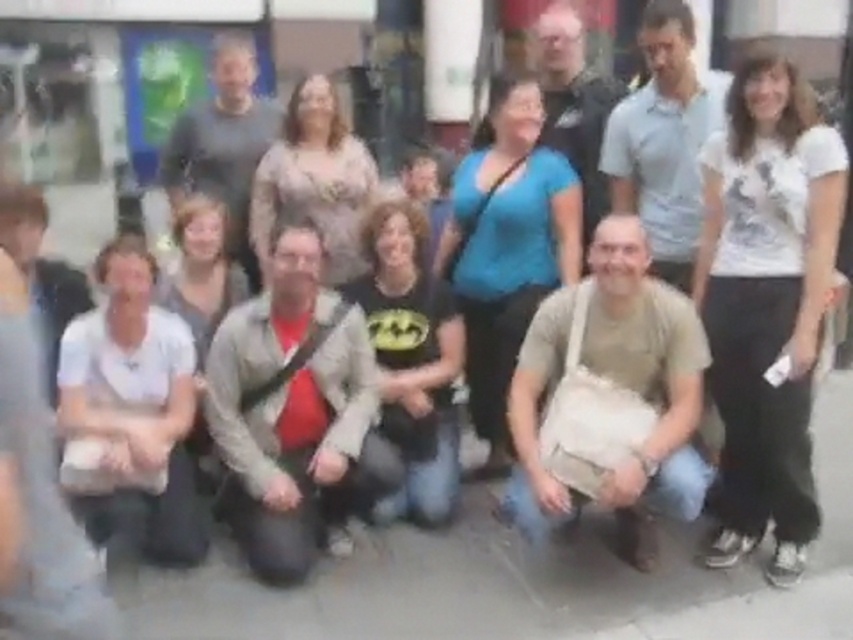
You are a photographer trying to adjust the focus of your camera. You want to ensure both the gray concrete pavement at lower center and the white cotton shirt at lower left are in focus. Given their distance apart, can you determine if they can be in focus simultaneously?

The gray concrete pavement at lower center and the white cotton shirt at lower left are 31.45 inches apart. Since they are within a reasonable distance, they can likely be in focus simultaneously if the camera is set with an appropriate aperture and focal point.

You are a photographer trying to capture a clear shot of the group. You notice a specific point in the image labeled as point [525,577]. Based on the scene description, what is located at that point?

The point [525,577] indicates gray concrete pavement at lower center.